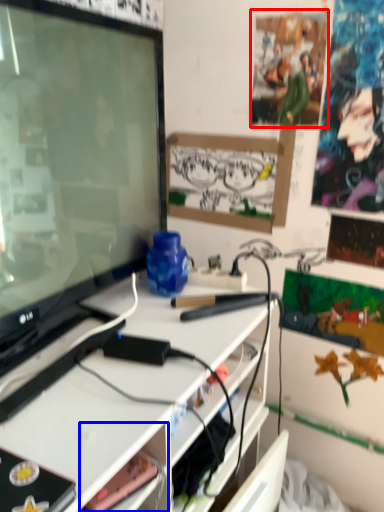
Question: Which object appears closest to the camera in this image, poster (highlighted by a red box) or shelf (highlighted by a blue box)?

Choices:
 (A) poster
 (B) shelf

Answer: (B)